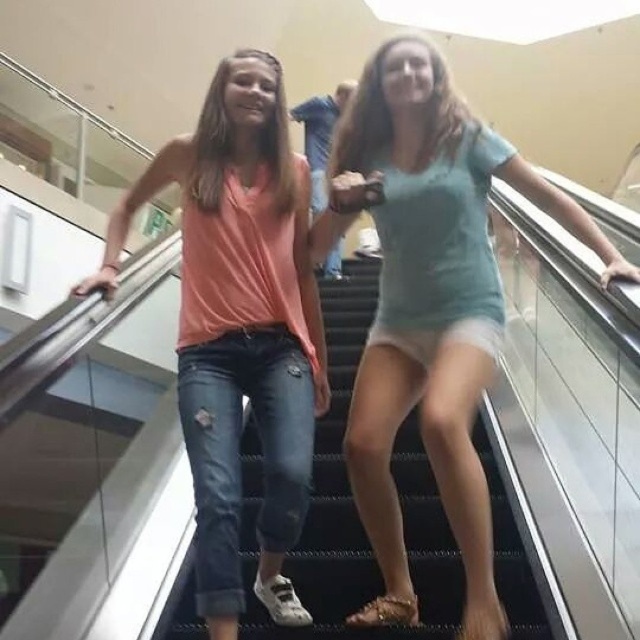
Question: Which of the following is the farthest from the observer?

Choices:
 (A) matte orange shirt at center
 (B) denim at center

Answer: (B)

Question: Does light blue fabric shorts at center appear on the left side of matte orange shirt at center?

Choices:
 (A) yes
 (B) no

Answer: (B)

Question: Which of the following is the farthest from the observer?

Choices:
 (A) denim at center
 (B) matte orange shirt at center

Answer: (A)

Question: Is light blue fabric shorts at center closer to the viewer compared to denim at center?

Choices:
 (A) yes
 (B) no

Answer: (A)

Question: Does matte orange shirt at center have a larger size compared to denim at center?

Choices:
 (A) yes
 (B) no

Answer: (B)

Question: Which of the following is the farthest from the observer?

Choices:
 (A) (381, 624)
 (B) (246, 276)

Answer: (A)